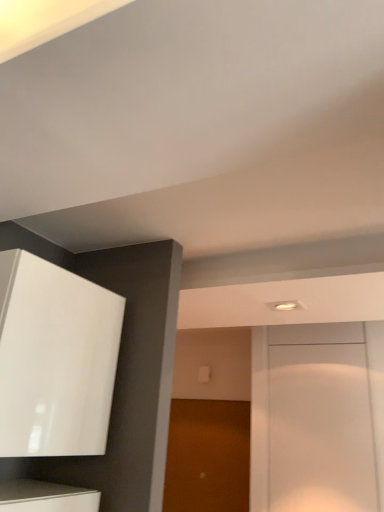
The width and height of the screenshot is (384, 512). What do you see at coordinates (317, 417) in the screenshot? I see `white glossy door at center, which ranks as the first door in right-to-left order` at bounding box center [317, 417].

Find the location of a particular element. Image resolution: width=384 pixels, height=512 pixels. brown matte door at center, the 1th door when ordered from back to front is located at coordinates (208, 456).

Is brown matte door at center, the second door viewed from the front, taller than glossy white cabinet at upper left?

Yes.

From the image's perspective, is brown matte door at center, which is counted as the 1th door, starting from the left, located above glossy white cabinet at upper left?

Incorrect, from the image's perspective, brown matte door at center, which is counted as the 1th door, starting from the left, is lower than glossy white cabinet at upper left.

From the image's perspective, is white glossy door at center, which ranks as the first door in right-to-left order, under brown matte door at center, which is counted as the 1th door, starting from the left?

No.

From a real-world perspective, is white glossy door at center, the 2th door from the left, above or below brown matte door at center, the second door positioned from the right?

In terms of real-world spatial position, white glossy door at center, the 2th door from the left, is above brown matte door at center, the second door positioned from the right.

In the image, is white glossy door at center, which ranks as the second door in back-to-front order, on the left side or the right side of brown matte door at center, the second door viewed from the front?

white glossy door at center, which ranks as the second door in back-to-front order, is positioned on brown matte door at center, the second door viewed from the front,'s right side.

Looking at this image, how different are the orientations of white glossy door at center, which ranks as the first door in right-to-left order, and brown matte door at center, the second door positioned from the right, in degrees?

They differ by 0.00119 degrees in their facing directions.

Between glossy white cabinet at upper left and white glossy door at center, the 2th door from the left, which one has larger width?

Wider between the two is glossy white cabinet at upper left.

Is glossy white cabinet at upper left facing towards white glossy door at center, which ranks as the first door in right-to-left order?

No.

Is glossy white cabinet at upper left smaller than white glossy door at center, which ranks as the second door in back-to-front order?

Actually, glossy white cabinet at upper left might be larger than white glossy door at center, which ranks as the second door in back-to-front order.

From a real-world perspective, is glossy white cabinet at upper left above or below white glossy door at center, which ranks as the first door in right-to-left order?

glossy white cabinet at upper left is situated higher than white glossy door at center, which ranks as the first door in right-to-left order, in the real world.

Is white glossy door at center, placed as the first door when sorted from front to back, a part of brown matte door at center, the second door viewed from the front?

No, white glossy door at center, placed as the first door when sorted from front to back, is not inside brown matte door at center, the second door viewed from the front.

Considering the positions of point (244, 423) and point (253, 452), is point (244, 423) closer or farther from the camera than point (253, 452)?

Clearly, point (244, 423) is more distant from the camera than point (253, 452).

From the image's perspective, which object appears higher, brown matte door at center, the second door viewed from the front, or white glossy door at center, the 2th door from the left?

white glossy door at center, the 2th door from the left, is shown above in the image.

Could you tell me if brown matte door at center, the second door viewed from the front, is facing white glossy door at center, which ranks as the first door in right-to-left order?

No.

How different are the orientations of glossy white cabinet at upper left and brown matte door at center, which is counted as the 1th door, starting from the left, in degrees?

The angular difference between glossy white cabinet at upper left and brown matte door at center, which is counted as the 1th door, starting from the left, is 90.7 degrees.

Does point (27, 399) come behind point (225, 418)?

No, (27, 399) is closer to viewer.

Who is smaller, glossy white cabinet at upper left or brown matte door at center, the 1th door when ordered from back to front?

brown matte door at center, the 1th door when ordered from back to front.

Who is shorter, glossy white cabinet at upper left or brown matte door at center, the 1th door when ordered from back to front?

Standing shorter between the two is glossy white cabinet at upper left.

Is point (340, 389) positioned in front of point (10, 283)?

No, (340, 389) is behind (10, 283).

Which object is positioned more to the right, white glossy door at center, which ranks as the second door in back-to-front order, or glossy white cabinet at upper left?

white glossy door at center, which ranks as the second door in back-to-front order.

Is white glossy door at center, which ranks as the second door in back-to-front order, positioned before glossy white cabinet at upper left?

No.

From a real-world perspective, which object stands above the other?

In real-world perspective, glossy white cabinet at upper left is above.

Locate an element on the screen. This screenshot has height=512, width=384. cabinetry that appears on the left of brown matte door at center, which is counted as the 1th door, starting from the left is located at coordinates (55, 359).

This screenshot has height=512, width=384. What are the coordinates of `door in front of the brown matte door at center, the second door positioned from the right` in the screenshot? It's located at (317, 417).

Looking at this image, looking at the image, which one is located closer to glossy white cabinet at upper left, brown matte door at center, the second door viewed from the front, or white glossy door at center, the 2th door from the left?

The object closer to glossy white cabinet at upper left is white glossy door at center, the 2th door from the left.

Estimate the real-world distances between objects in this image. Which object is further from white glossy door at center, which ranks as the second door in back-to-front order, glossy white cabinet at upper left or brown matte door at center, the second door positioned from the right?

glossy white cabinet at upper left.

Looking at the image, which one is located further to brown matte door at center, the second door positioned from the right, glossy white cabinet at upper left or white glossy door at center, the 2th door from the left?

glossy white cabinet at upper left lies further to brown matte door at center, the second door positioned from the right, than the other object.

Looking at the image, which one is located closer to white glossy door at center, which ranks as the first door in right-to-left order, brown matte door at center, the second door positioned from the right, or glossy white cabinet at upper left?

Based on the image, brown matte door at center, the second door positioned from the right, appears to be nearer to white glossy door at center, which ranks as the first door in right-to-left order.

Which object lies further to the anchor point glossy white cabinet at upper left, white glossy door at center, which ranks as the second door in back-to-front order, or brown matte door at center, the 1th door when ordered from back to front?

Based on the image, brown matte door at center, the 1th door when ordered from back to front, appears to be further to glossy white cabinet at upper left.

Which object lies further to the anchor point brown matte door at center, the second door positioned from the right, white glossy door at center, which ranks as the second door in back-to-front order, or glossy white cabinet at upper left?

glossy white cabinet at upper left is positioned further to the anchor brown matte door at center, the second door positioned from the right.

Identify the location of door between glossy white cabinet at upper left and brown matte door at center, the 1th door when ordered from back to front, from front to back. (317, 417).